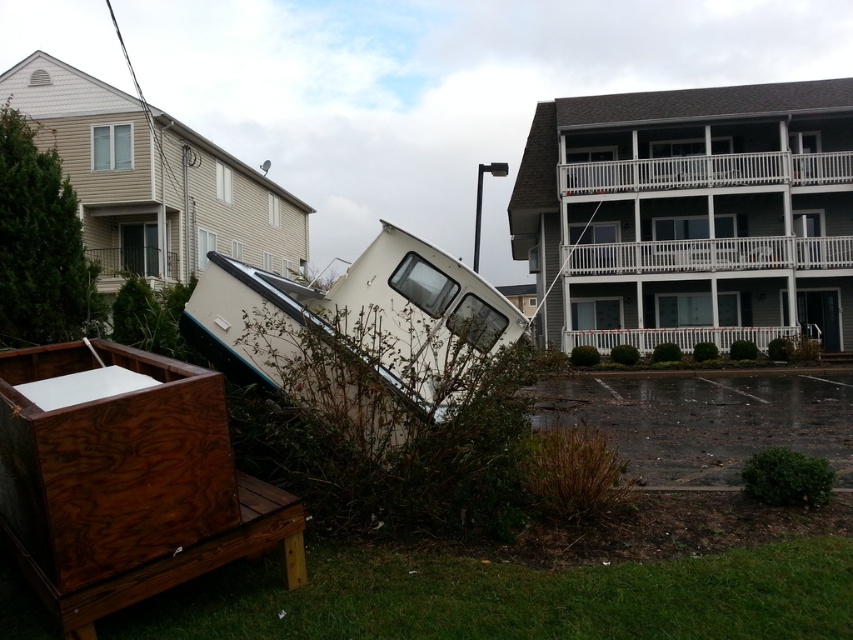
You are a delivery person trying to navigate through the damaged area. You need to move from the wooden crate at lower left to the white matte boat at center. Which object is closer to you as you start moving?

The wooden crate at lower left is closer to the viewer than the white matte boat at center, so you would start near the wooden crate at lower left.

You are a delivery person who needs to place a package on the wooden crate at lower left. The package requires a distance of at least 3 meters from the camera to ensure safety. Based on the scene, can you safely place the package there?

The wooden crate at lower left is only 2.54 meters away from the camera, which is less than the required 3 meters. Therefore, placing the package there would not meet the safety requirement.

You are a delivery person who needs to place a package between the wooden crate at lower left and the white matte boat at center. The package requires a minimum of 5 feet of space to be placed safely. Can you fit it there?

The wooden crate at lower left and white matte boat at center are 4.98 feet apart, which is slightly less than the required 5 feet. Therefore, the package cannot be placed safely between them.